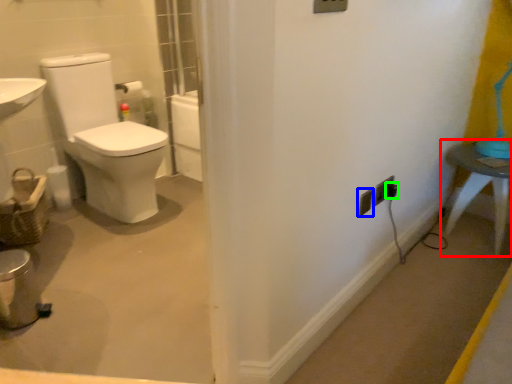
Question: Considering the real-world distances, which object is farthest from table (highlighted by a red box)? electric outlet (highlighted by a blue box) or electric outlet (highlighted by a green box)?

Choices:
 (A) electric outlet
 (B) electric outlet

Answer: (A)